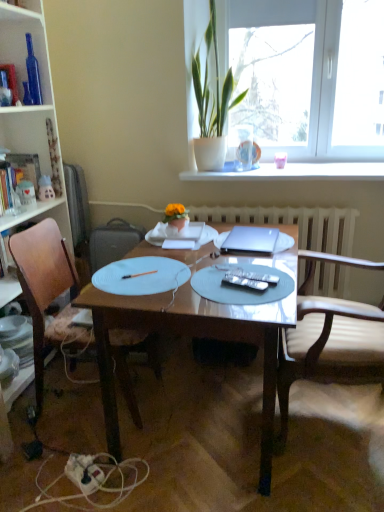
You are a GUI agent. You are given a task and a screenshot of the screen. Output one action in this format:
    pyautogui.click(x=<x>, y=<y>)
    Task: Click on the vacant space situated above matte white plate at lower left (from a real-world perspective)
    This screenshot has width=384, height=512.
    Given the screenshot: What is the action you would take?
    pyautogui.click(x=13, y=323)